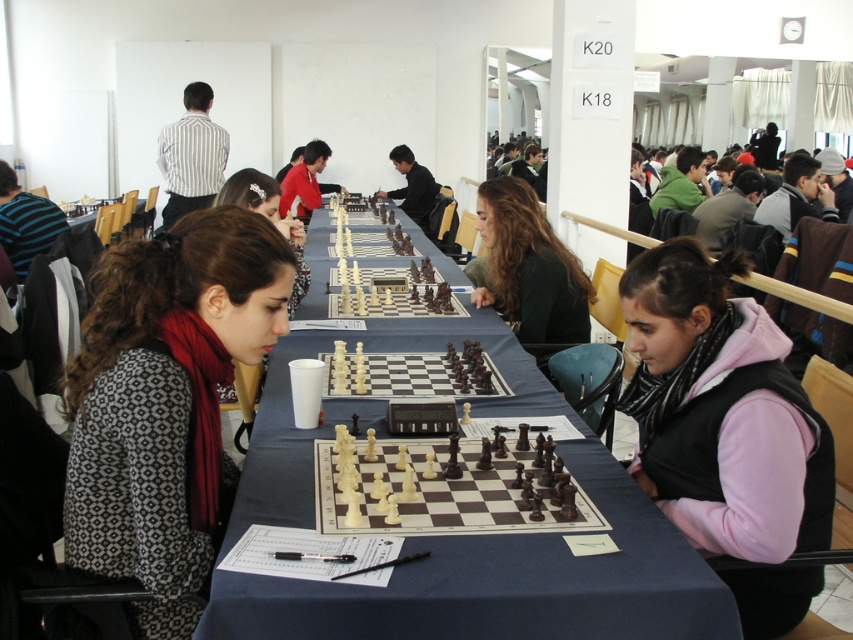
Question: Which point is farther to the camera?

Choices:
 (A) green matte shirt at center
 (B) white striped shirt at upper center
 (C) matte black hair at center

Answer: (B)

Question: Does wooden chessboard at center appear on the left side of patterned fabric scarf at left?

Choices:
 (A) yes
 (B) no

Answer: (B)

Question: Which is farther from the pink fleece at center?

Choices:
 (A) matte black hair at center
 (B) green matte shirt at center

Answer: (A)

Question: Is green matte shirt at center further to the viewer compared to white striped shirt at upper center?

Choices:
 (A) yes
 (B) no

Answer: (B)

Question: Which object is the farthest from the matte black hair at center?

Choices:
 (A) pink fleece at center
 (B) wooden chessboard at center

Answer: (A)

Question: Is patterned fabric scarf at left behind pink fleece at center?

Choices:
 (A) no
 (B) yes

Answer: (A)